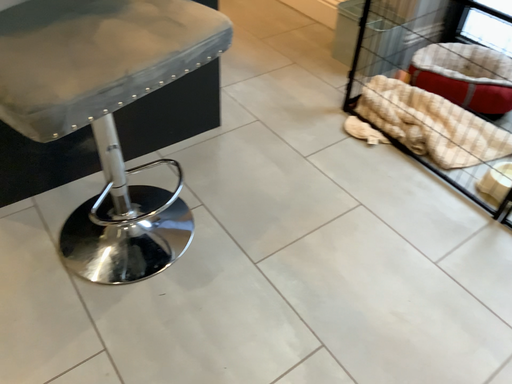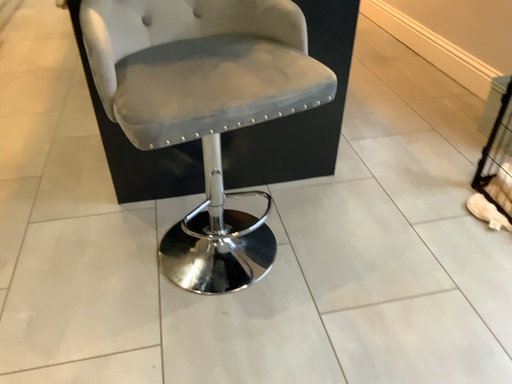
Question: Which way did the camera rotate in the video?

Choices:
 (A) rotated left
 (B) rotated right

Answer: (A)